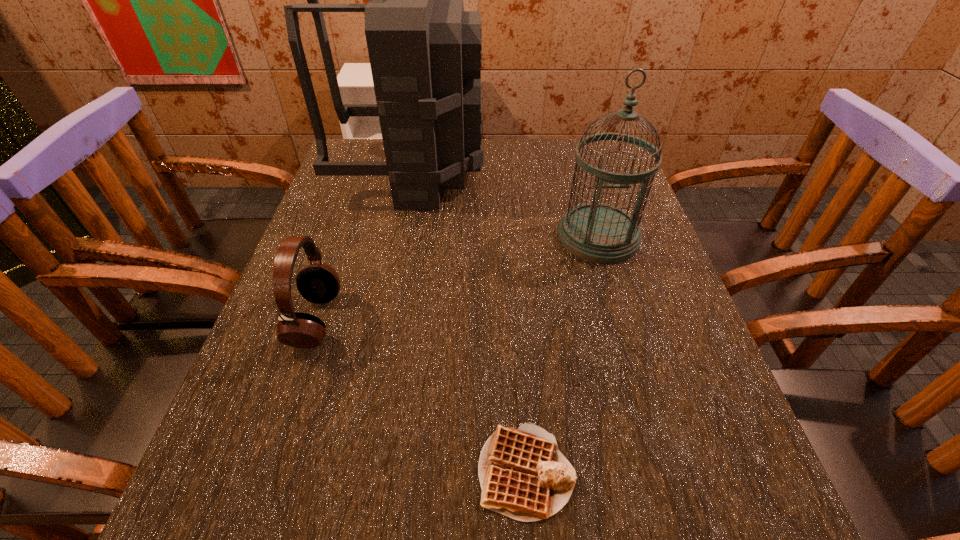
Image resolution: width=960 pixels, height=540 pixels. I want to click on vacant space that satisfies the following two spatial constraints: 1. on the back side of the shortest object; 2. on the front compartment of the tallest object, so click(x=505, y=173).

Where is `vacant space that satisfies the following two spatial constraints: 1. on the back side of the shortest object; 2. on the ear pads of the headset`? vacant space that satisfies the following two spatial constraints: 1. on the back side of the shortest object; 2. on the ear pads of the headset is located at coordinates (516, 320).